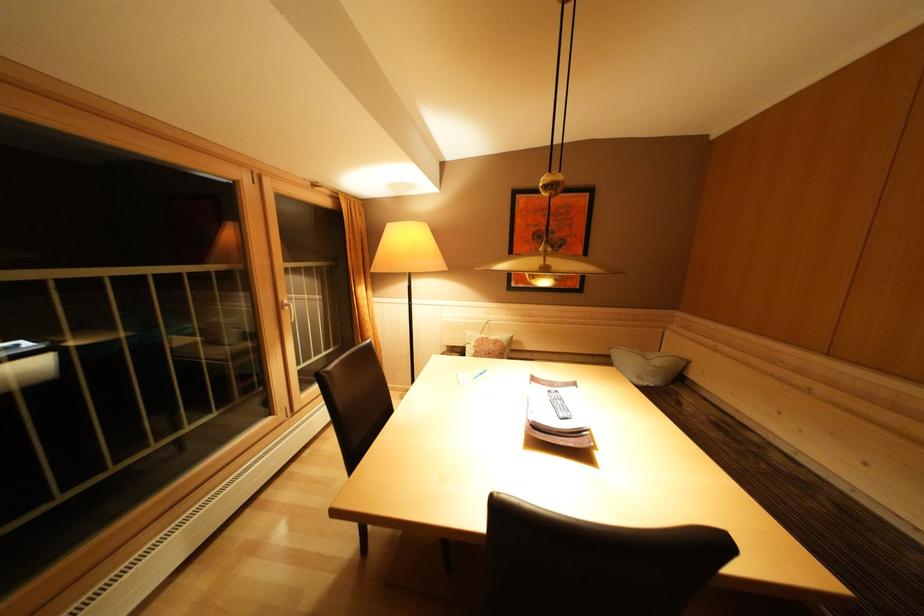
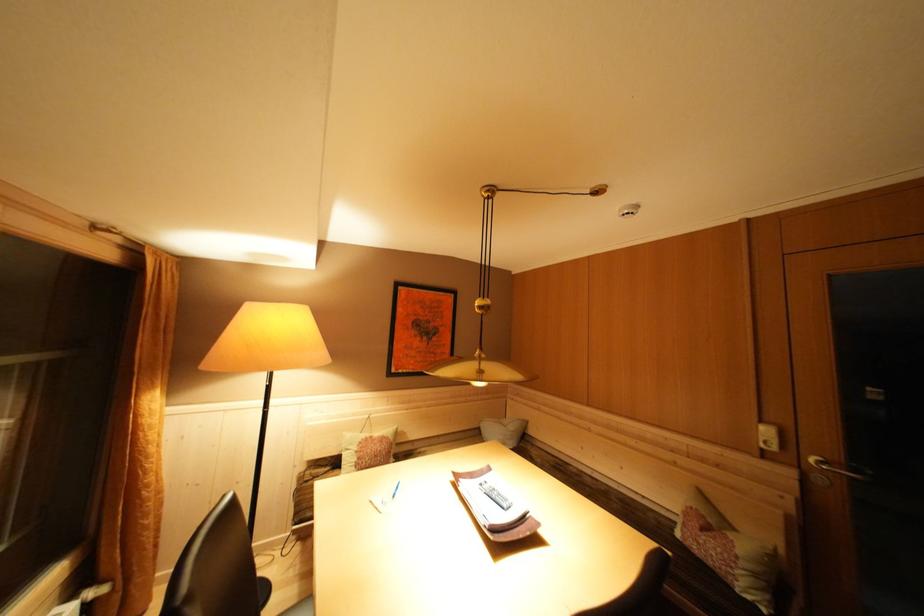
The point at (666, 365) is marked in the first image. Where is the corresponding point in the second image?

(518, 430)